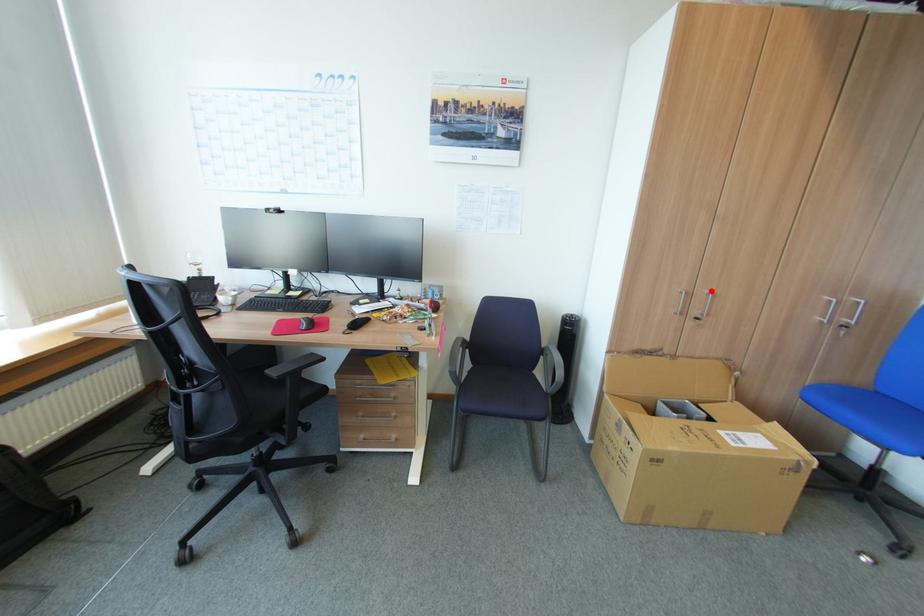
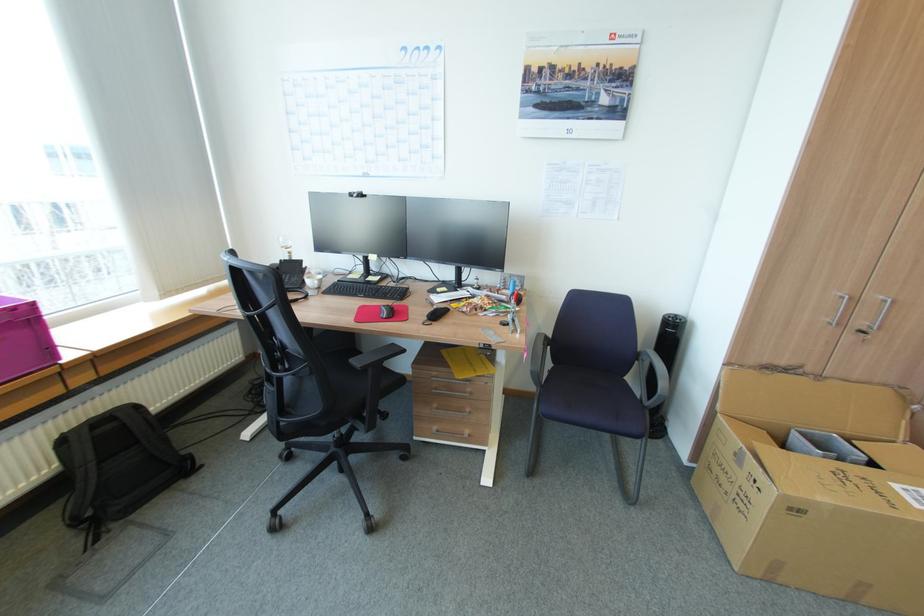
Locate, in the second image, the point that corresponds to the highlighted location in the first image.

(888, 297)